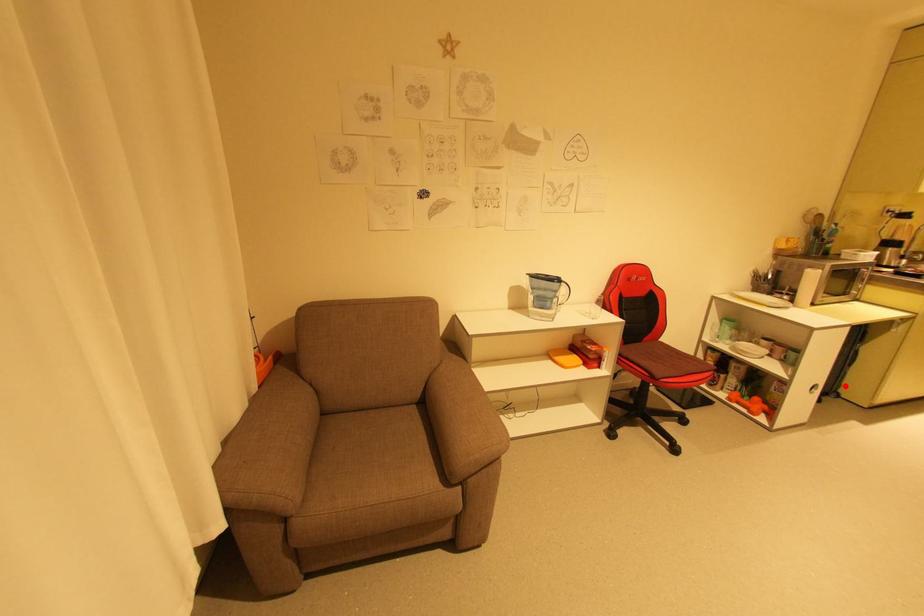
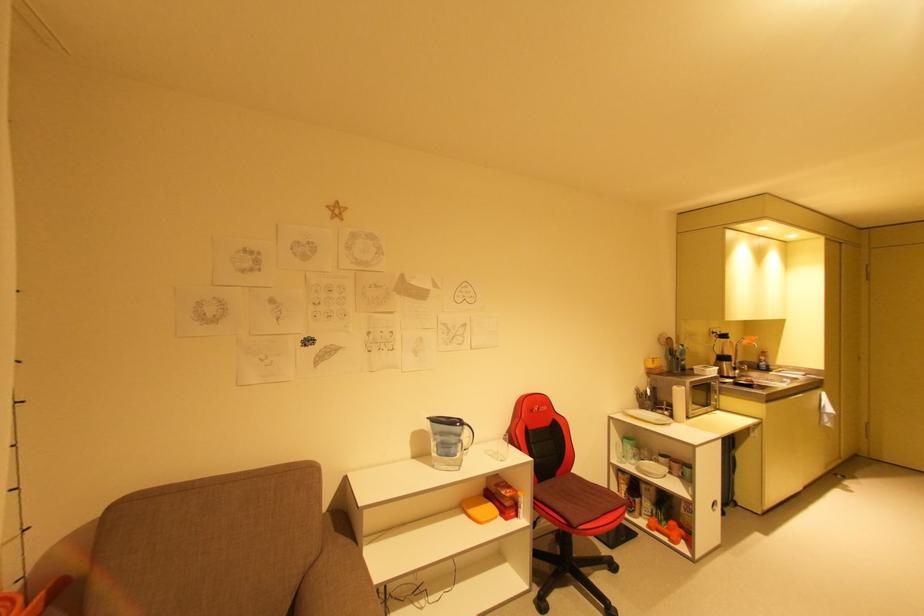
Question: I am providing you with two images of the same scene from different viewpoints. A red point is shown in image1. For the corresponding object point in image2, is it positioned nearer or farther from the camera?

Choices:
 (A) Nearer
 (B) Farther

Answer: (B)